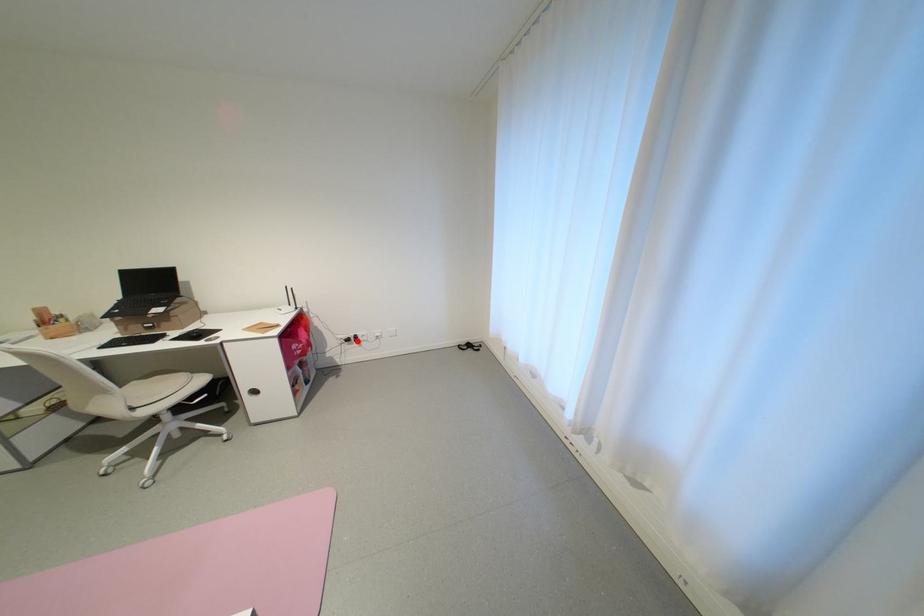
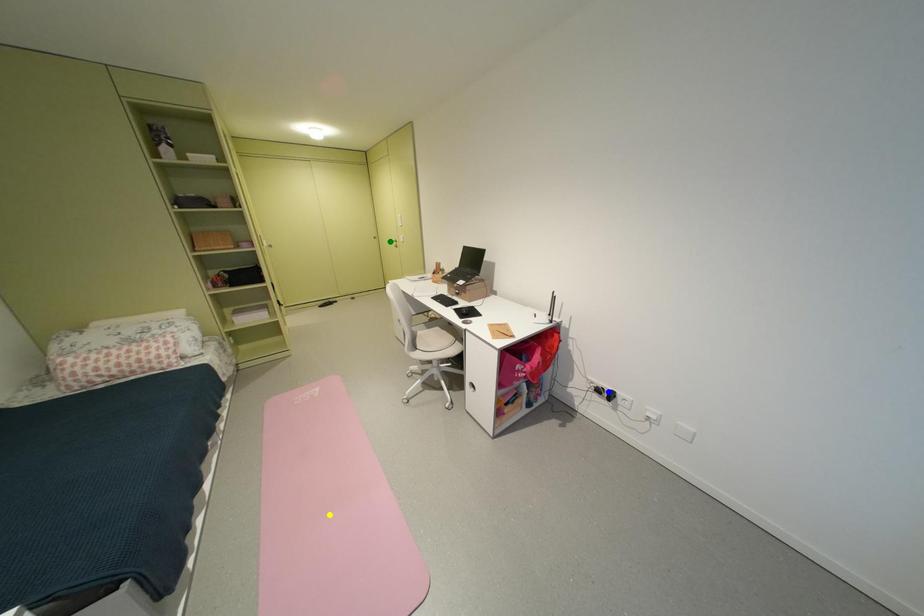
Question: I am providing you with two images of the same scene from different viewpoints. A red point is marked on the first image. You are given multiple points on the second image. Can you choose the point in image 2 that corresponds to the point in image 1?

Choices:
 (A) blue point
 (B) yellow point
 (C) green point

Answer: (A)